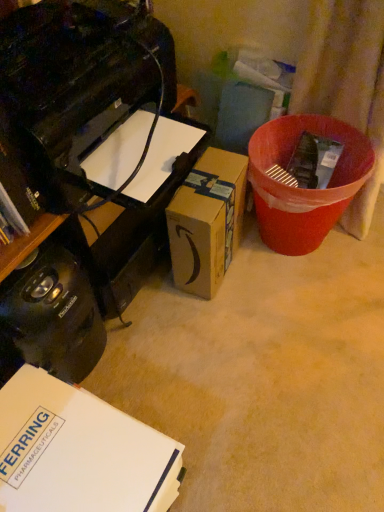
The width and height of the screenshot is (384, 512). Find the location of `black plastic printer at left`. black plastic printer at left is located at coordinates (129, 236).

Measure the distance between red plastic bin at right and camera.

red plastic bin at right is 96.13 centimeters from camera.

Find the location of a particular element. The width and height of the screenshot is (384, 512). black glossy printer at upper left is located at coordinates (78, 77).

Identify the location of black plastic toaster at lower left. (50, 317).

Relative to white cardboard box at lower left, arranged as the first box when viewed from the front, is red plastic bin at right in front or behind?

In the image, red plastic bin at right appears behind white cardboard box at lower left, arranged as the first box when viewed from the front.

Considering the positions of objects red plastic bin at right and white cardboard box at lower left, arranged as the first box when viewed from the front, in the image provided, who is more to the right, red plastic bin at right or white cardboard box at lower left, arranged as the first box when viewed from the front,?

Positioned to the right is red plastic bin at right.

Find the location of `recycling bin to the right of white cardboard box at lower left, arranged as the first box when viewed from the front`. recycling bin to the right of white cardboard box at lower left, arranged as the first box when viewed from the front is located at coordinates (302, 188).

Could you measure the distance between red plastic bin at right and white cardboard box at lower left, the first box when ordered from left to right?

red plastic bin at right is 27.17 inches from white cardboard box at lower left, the first box when ordered from left to right.

Is point (221, 211) less distant than point (30, 395)?

No, it is behind (30, 395).

Is there a large distance between brown cardboard box at center, the 1th box from the back, and white cardboard box at lower left, the first box when ordered from left to right?

No, there isn't a large distance between brown cardboard box at center, the 1th box from the back, and white cardboard box at lower left, the first box when ordered from left to right.

From the image's perspective, who appears lower, brown cardboard box at center, the 1th box from the back, or white cardboard box at lower left, the first box when ordered from left to right?

white cardboard box at lower left, the first box when ordered from left to right.

From a real-world perspective, is brown cardboard box at center, the 1th box from the back, positioned over red plastic bin at right based on gravity?

Yes, from a real-world perspective, brown cardboard box at center, the 1th box from the back, is above red plastic bin at right.

From the picture: Considering the sizes of objects brown cardboard box at center, the 1th box from the back, and red plastic bin at right in the image provided, who is bigger, brown cardboard box at center, the 1th box from the back, or red plastic bin at right?

red plastic bin at right.

Does point (179, 266) appear closer or farther from the camera than point (255, 136)?

Point (179, 266) appears to be closer to the viewer than point (255, 136).

Which of these two, brown cardboard box at center, which is counted as the first box, starting from the right, or red plastic bin at right, is wider?

With larger width is red plastic bin at right.

From the image's perspective, which one is positioned higher, black plastic toaster at lower left or white cardboard box at lower left, placed as the 2th box when sorted from back to front?

black plastic toaster at lower left is shown above in the image.

Would you say black plastic toaster at lower left is to the left or to the right of white cardboard box at lower left, the 1th box positioned from the bottom, in the picture?

Clearly, black plastic toaster at lower left is on the left of white cardboard box at lower left, the 1th box positioned from the bottom, in the image.

You are a GUI agent. You are given a task and a screenshot of the screen. Output one action in this format:
    pyautogui.click(x=<x>, y=<y>)
    Task: Click on the appliance behind the white cardboard box at lower left, the 1th box positioned from the bottom
    
    Given the screenshot: What is the action you would take?
    pyautogui.click(x=50, y=317)

Is red plastic bin at right far from brown cardboard box at center, the 1th box from the back?

That's not correct — red plastic bin at right is a little close to brown cardboard box at center, the 1th box from the back.

In the scene shown: Is red plastic bin at right wider or thinner than brown cardboard box at center, placed as the 2th box when sorted from bottom to top?

Clearly, red plastic bin at right has more width compared to brown cardboard box at center, placed as the 2th box when sorted from bottom to top.

The width and height of the screenshot is (384, 512). In order to click on recycling bin that is under the brown cardboard box at center, arranged as the 2th box when viewed from the left (from a real-world perspective) in this screenshot , I will do `click(302, 188)`.

Consider the image. Does red plastic bin at right appear on the right side of brown cardboard box at center, which is counted as the first box, starting from the right?

Correct, you'll find red plastic bin at right to the right of brown cardboard box at center, which is counted as the first box, starting from the right.

Is black plastic printer at left far away from white cardboard box at lower left, the first box when ordered from left to right?

black plastic printer at left is near white cardboard box at lower left, the first box when ordered from left to right, not far away.

Is black plastic printer at left taller or shorter than white cardboard box at lower left, the 1th box positioned from the bottom?

In the image, black plastic printer at left appears to be shorter than white cardboard box at lower left, the 1th box positioned from the bottom.

Is the position of black plastic printer at left more distant than that of white cardboard box at lower left, the 2th box viewed from the top?

Yes, the depth of black plastic printer at left is greater than that of white cardboard box at lower left, the 2th box viewed from the top.

Is point (117, 302) in front of point (15, 461)?

No, it is not.

Between black plastic toaster at lower left and black glossy printer at upper left, which one appears on the right side from the viewer's perspective?

black glossy printer at upper left is more to the right.

Locate an element on the screen. printer in front of the black plastic toaster at lower left is located at coordinates (78, 77).

From the picture: Does black plastic toaster at lower left have a lesser width compared to black glossy printer at upper left?

Yes.

Does black plastic toaster at lower left have a greater height compared to black glossy printer at upper left?

Yes, black plastic toaster at lower left is taller than black glossy printer at upper left.

Image resolution: width=384 pixels, height=512 pixels. I want to click on recycling bin on the right of the white cardboard box at lower left, the first box when ordered from left to right, so click(x=302, y=188).

Identify the location of box below the brown cardboard box at center, arranged as the 2th box when viewed from the left (from the image's perspective). This screenshot has width=384, height=512. (79, 451).

Which object lies further to the anchor point red plastic bin at right, brown cardboard box at center, which is counted as the first box, starting from the top, or black glossy printer at upper left?

black glossy printer at upper left.

Considering their positions, is brown cardboard box at center, which is counted as the first box, starting from the top, positioned closer to black plastic toaster at lower left than black plastic printer at left?

The object closer to black plastic toaster at lower left is black plastic printer at left.

When comparing their distances from black glossy printer at upper left, does red plastic bin at right or brown cardboard box at center, which is the 2th box in front-to-back order, seem closer?

brown cardboard box at center, which is the 2th box in front-to-back order, is closer to black glossy printer at upper left.

Estimate the real-world distances between objects in this image. Which object is further from white cardboard box at lower left, arranged as the first box when viewed from the front, brown cardboard box at center, which is counted as the first box, starting from the top, or black glossy printer at upper left?

Based on the image, black glossy printer at upper left appears to be further to white cardboard box at lower left, arranged as the first box when viewed from the front.

Estimate the real-world distances between objects in this image. Which object is closer to red plastic bin at right, black glossy printer at upper left or white cardboard box at lower left, the first box when ordered from left to right?

The object closer to red plastic bin at right is black glossy printer at upper left.

When comparing their distances from black glossy printer at upper left, does black plastic toaster at lower left or brown cardboard box at center, which is the 2th box in front-to-back order, seem further?

Based on the image, brown cardboard box at center, which is the 2th box in front-to-back order, appears to be further to black glossy printer at upper left.

From the image, which object appears to be nearer to black plastic toaster at lower left, red plastic bin at right or brown cardboard box at center, the 1th box from the back?

brown cardboard box at center, the 1th box from the back, lies closer to black plastic toaster at lower left than the other object.

When comparing their distances from black plastic toaster at lower left, does black glossy printer at upper left or white cardboard box at lower left, the first box when ordered from left to right, seem further?

Based on the image, black glossy printer at upper left appears to be further to black plastic toaster at lower left.

Locate an element on the screen. printer situated between black plastic toaster at lower left and red plastic bin at right from left to right is located at coordinates (78, 77).

Find the location of `appliance between brown cardboard box at center, the 1th box from the back, and white cardboard box at lower left, arranged as the first box when viewed from the front, from top to bottom`. appliance between brown cardboard box at center, the 1th box from the back, and white cardboard box at lower left, arranged as the first box when viewed from the front, from top to bottom is located at coordinates (50, 317).

Locate an element on the screen. This screenshot has width=384, height=512. appliance between black glossy printer at upper left and white cardboard box at lower left, arranged as the first box when viewed from the front, from top to bottom is located at coordinates (50, 317).

At what (x,y) coordinates should I click in order to perform the action: click on box situated between black glossy printer at upper left and red plastic bin at right from left to right. Please return your answer as a coordinate pair (x, y). The image size is (384, 512). Looking at the image, I should click on (207, 221).